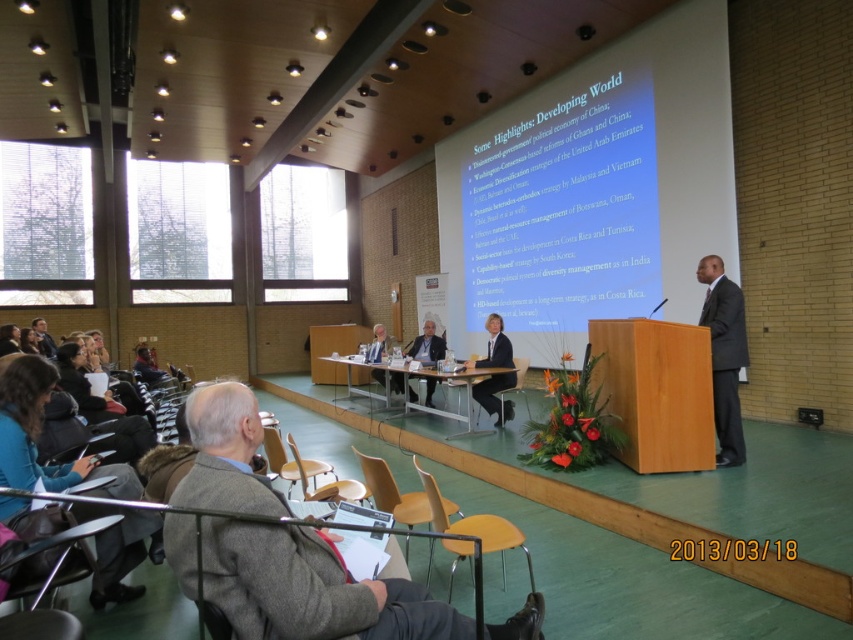
Which of these two, dark suit at center or light brown wood table at center, stands shorter?

light brown wood table at center

Can you confirm if dark suit at center is smaller than light brown wood table at center?

Indeed, dark suit at center has a smaller size compared to light brown wood table at center.

Locate an element on the screen. Image resolution: width=853 pixels, height=640 pixels. dark suit at center is located at coordinates (724, 355).

Between point (711, 316) and point (509, 400), which one is positioned behind?

Point (509, 400)

Is point (729, 449) farther from viewer compared to point (515, 356)?

No.

Where is `dark suit at center`? The image size is (853, 640). dark suit at center is located at coordinates (724, 355).

Is the position of dark suit at center less distant than that of yellow wood chair at center?

No, it is not.

Can you confirm if dark suit at center is positioned to the left of yellow wood chair at center?

No, dark suit at center is not to the left of yellow wood chair at center.

Is point (727, 305) closer to viewer compared to point (451, 528)?

No, it is behind (451, 528).

I want to click on dark suit at center, so click(x=724, y=355).